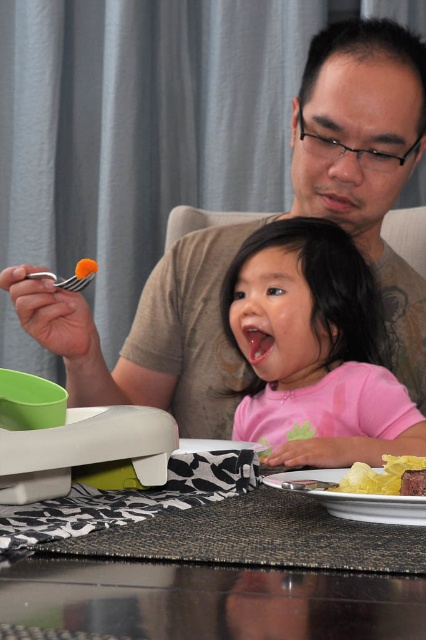
You are a photographer taking a portrait of the matte brown shirt at upper center and the pink matte shirt at center. Which shirt should you focus on first if you want to capture both in the same frame without moving the camera?

The matte brown shirt at upper center is above the pink matte shirt at center, so you should focus on the matte brown shirt at upper center first to ensure both are in the frame.